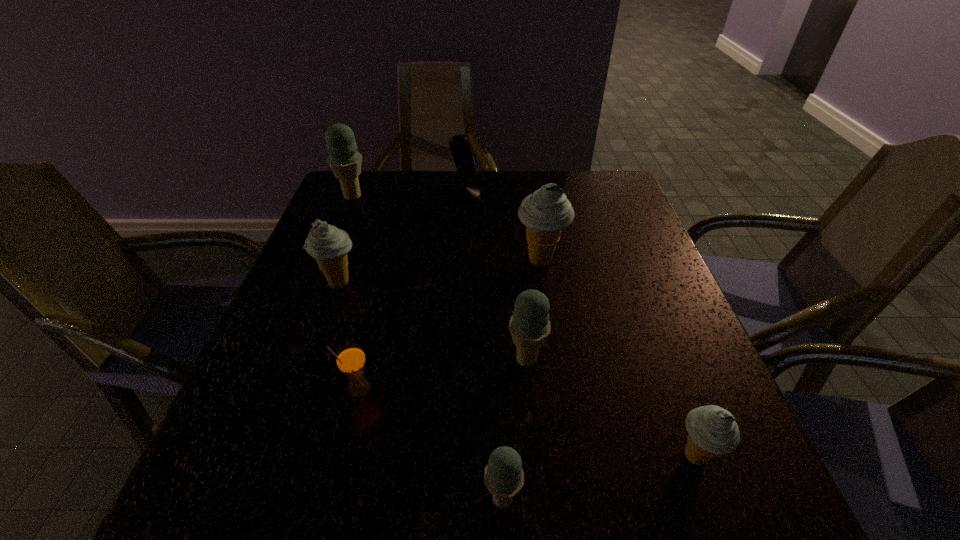
Locate an element on the screen. free space that satisfies the following two spatial constraints: 1. on the front side of the biggest blue ice cream; 2. on the right side of the third nearest ice cream is located at coordinates (287, 359).

Locate an element on the screen. This screenshot has width=960, height=540. vacant space that satisfies the following two spatial constraints: 1. on the stand of the microphone; 2. on the back side of the second beige icecream from right to left is located at coordinates click(x=461, y=261).